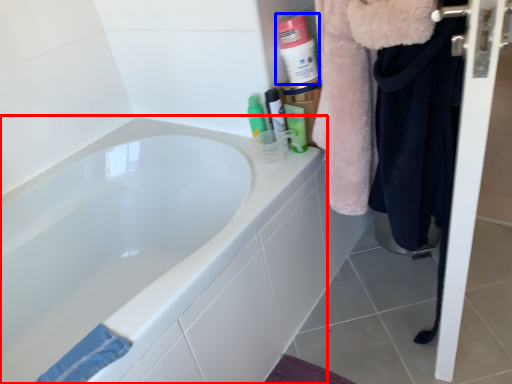
Question: Which point is closer to the camera, bathtub (highlighted by a red box) or cleaning product (highlighted by a blue box)?

Choices:
 (A) bathtub
 (B) cleaning product

Answer: (A)